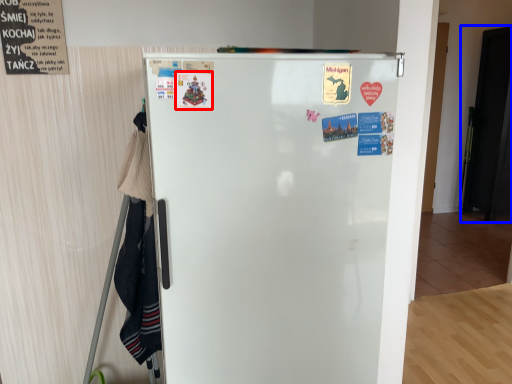
Question: Which of the following is the closest to the observer, poster (highlighted by a red box) or door (highlighted by a blue box)?

Choices:
 (A) poster
 (B) door

Answer: (A)